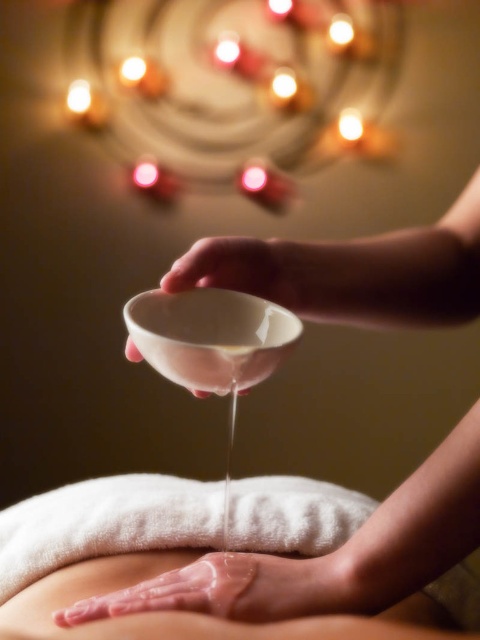
You are a spa therapist observing the scene. You notice the translucent plastic bowl at upper center and the glossy skin at center. Which object is closer to you, the therapist?

The translucent plastic bowl at upper center is closer to you because it is positioned in front of the glossy skin at center.

From the picture: You are a spa therapist preparing to pour oil into the translucent plastic bowl at upper center. The bowl is located at coordinates approximately 0.867 on the x axis and 0.698 on the y axis. If you need to place a new candle holder exactly 0.1 units to the right of the bowl, what would be the new coordinates for the candle holder?

The translucent plastic bowl at upper center is at coordinates x 0.867 and y 0.698. To place the candle holder 0.1 units to the right, add 0.1 to the x coordinate. The new coordinates would be x 0.967 and y 0.698.

You are a spa assistant and need to place both the translucent plastic bowl at upper center and the white porcelain bowl at center on a shelf. The shelf has a width limit of 1 meter. Can both bowls fit side by side on the shelf?

The translucent plastic bowl at upper center is positioned on the right side of white porcelain bowl at center, but their widths are not specified. Without knowing their individual sizes, it is impossible to determine if they can fit on a 1 meter shelf together.